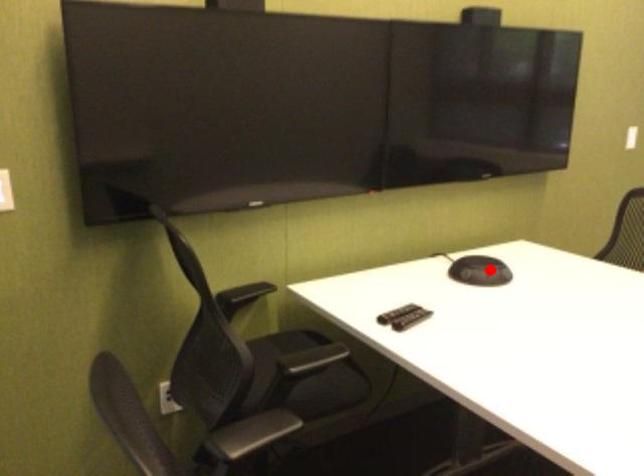
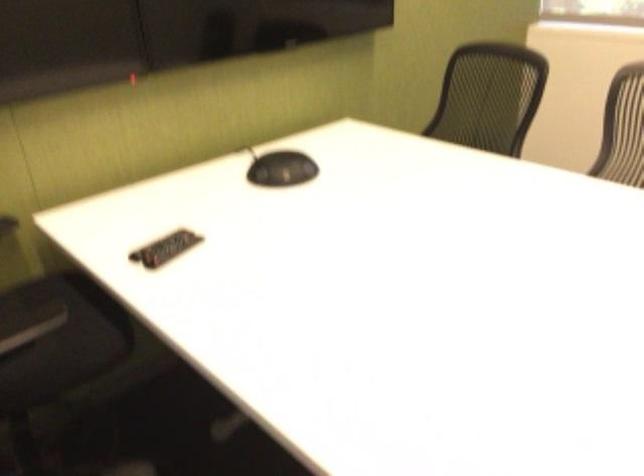
Question: I am providing you with two images of the same scene from different viewpoints. In image1, a red point is highlighted. Considering the same 3D point in image2, which of the following is correct?

Choices:
 (A) It is closer
 (B) It is farther

Answer: (A)